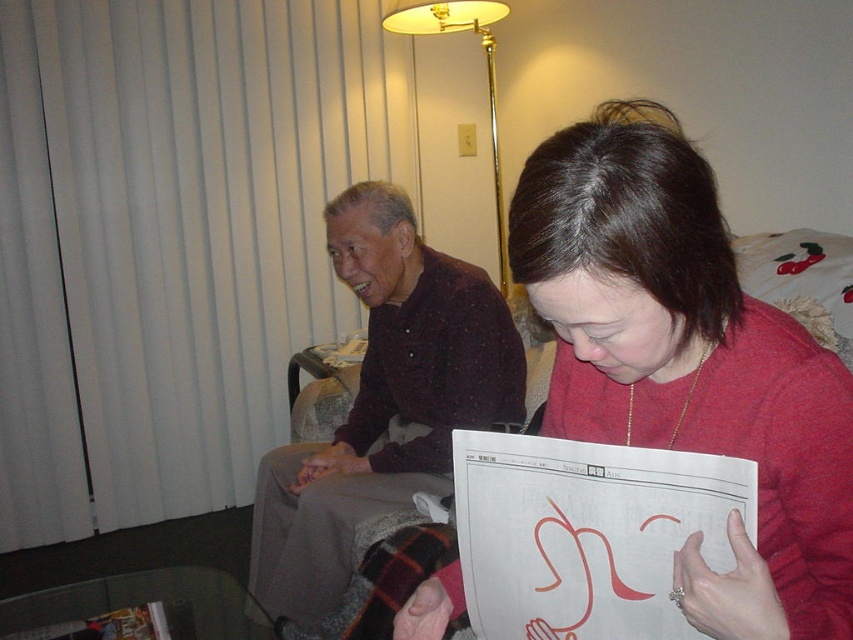
Between matte red sweater at center and gold metallic floor lamp at upper center, which one appears on the right side from the viewer's perspective?

matte red sweater at center is more to the right.

Measure the distance between matte red sweater at center and gold metallic floor lamp at upper center.

They are 2.06 meters apart.

Identify the location of matte red sweater at center. (688, 362).

Where is `matte red sweater at center`? matte red sweater at center is located at coordinates (688, 362).

Can you confirm if matte red sweater at center is positioned to the right of dark brown sweater at center?

Correct, you'll find matte red sweater at center to the right of dark brown sweater at center.

Where is `matte red sweater at center`? matte red sweater at center is located at coordinates (688, 362).

Who is positioned more to the left, dark brown sweater at center or gold metallic floor lamp at upper center?

dark brown sweater at center is more to the left.

Can you confirm if dark brown sweater at center is thinner than gold metallic floor lamp at upper center?

No.

Is point (375, 500) closer to camera compared to point (416, 10)?

Yes, point (375, 500) is in front of point (416, 10).

The width and height of the screenshot is (853, 640). Find the location of `dark brown sweater at center`. dark brown sweater at center is located at coordinates (384, 401).